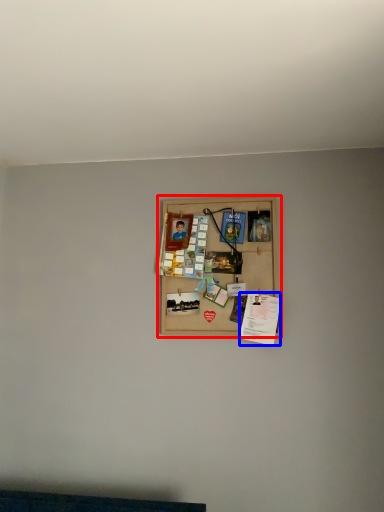
Question: Which point is closer to the camera, picture frame (highlighted by a red box) or writing (highlighted by a blue box)?

Choices:
 (A) picture frame
 (B) writing

Answer: (B)